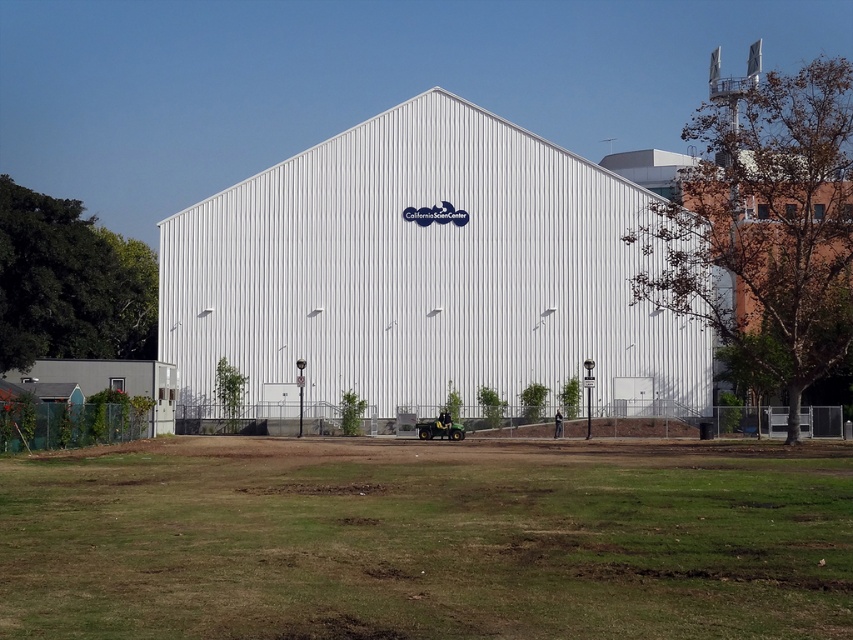
You are standing in front of the California Science Center building. There are two points marked on the ground. The first point is located at coordinates point (27, 472) and the second point is at point (299, 321). Which point is closer to the building?

Point (27, 472) is in front of point (299, 321), so the first point is closer to the building.

In the scene shown: You are standing in front of the white corrugated metal building at center and want to find a place to park your car. Can you park on the green grass at lower center without driving over the building?

The green grass at lower center is located below the white corrugated metal building at center, so you can park there without driving over the building.